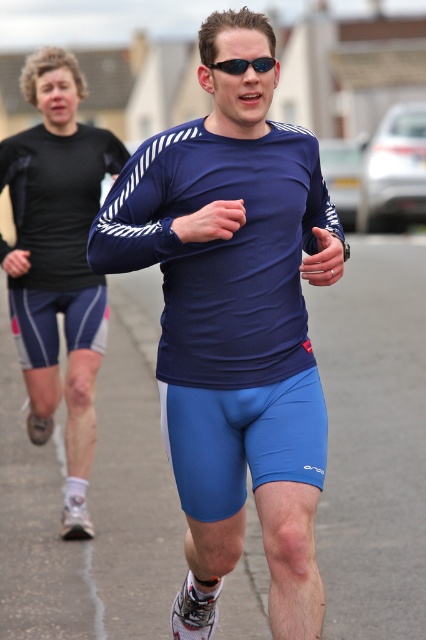
Question: Can you confirm if matte blue running suit at center is wider than matte black shorts at left?

Choices:
 (A) no
 (B) yes

Answer: (B)

Question: Which point is farther to the camera?

Choices:
 (A) (238, 65)
 (B) (69, 406)
 (C) (170, 323)

Answer: (B)

Question: Among these objects, which one is farthest from the camera?

Choices:
 (A) sunglasses at center
 (B) matte blue running suit at center

Answer: (A)

Question: Does matte black shorts at left come in front of sunglasses at center?

Choices:
 (A) no
 (B) yes

Answer: (A)

Question: Which point is closer to the camera?

Choices:
 (A) (172, 280)
 (B) (25, 372)
 (C) (233, 60)

Answer: (C)

Question: In this image, where is matte blue running suit at center located relative to matte black shorts at left?

Choices:
 (A) left
 (B) right

Answer: (B)